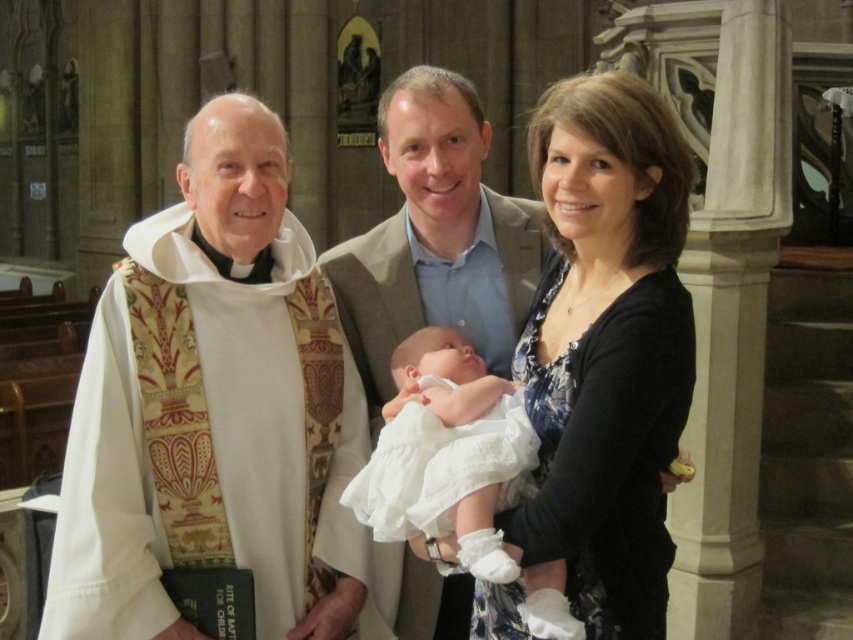
You are a photographer at the baptism ceremony. You need to capture a photo of the black floral dress at center and the light brown textured suit at center. Which one is shorter in height?

The black floral dress at center is shorter than the light brown textured suit at center.

You are a photographer positioned at the back of the church. You want to take a photo of the black floral dress at center and the white silk vestment at left. Which one is closer to you?

The black floral dress at center is behind the white silk vestment at left, so the white silk vestment at left is closer to you.